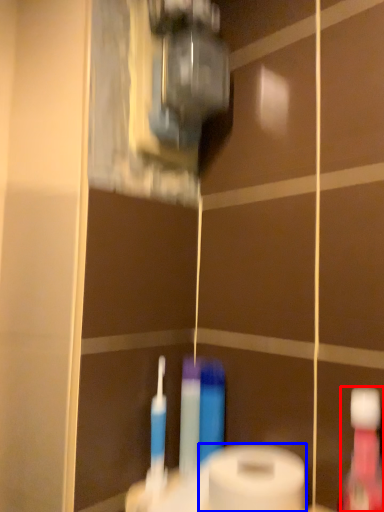
Question: Which of the following is the closest to the observer, mouthwash (highlighted by a red box) or toilet paper (highlighted by a blue box)?

Choices:
 (A) mouthwash
 (B) toilet paper

Answer: (A)